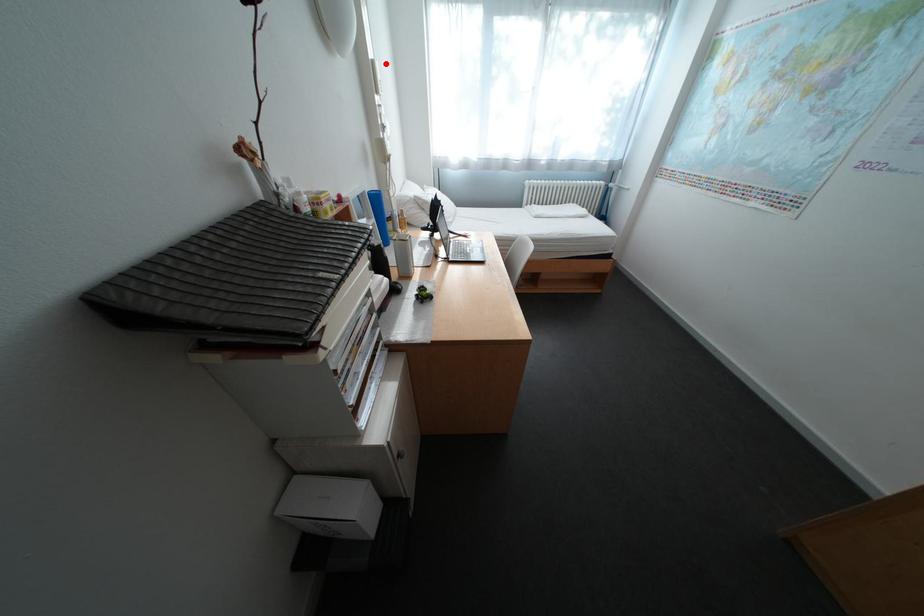
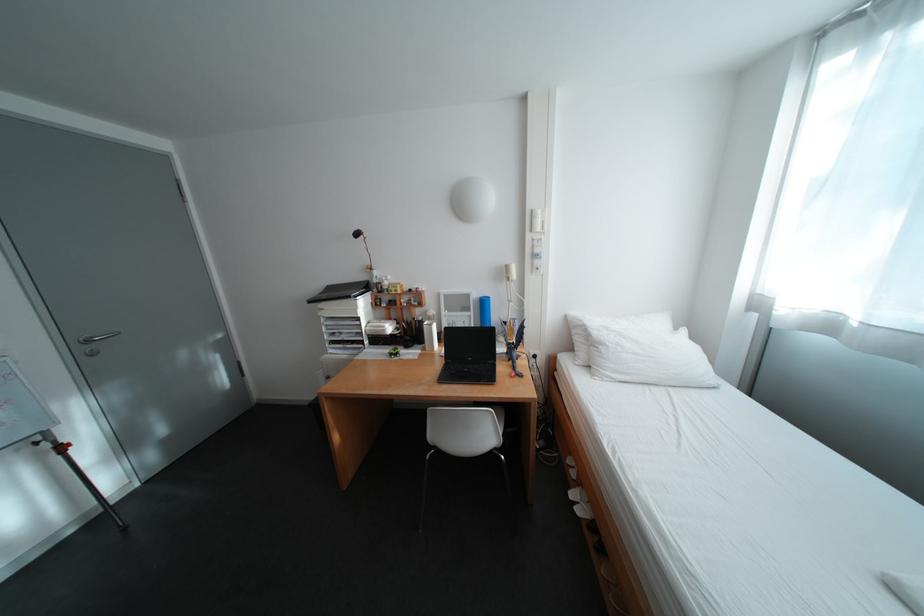
The point at the highlighted location is marked in the first image. Where is the corresponding point in the second image?

(544, 213)